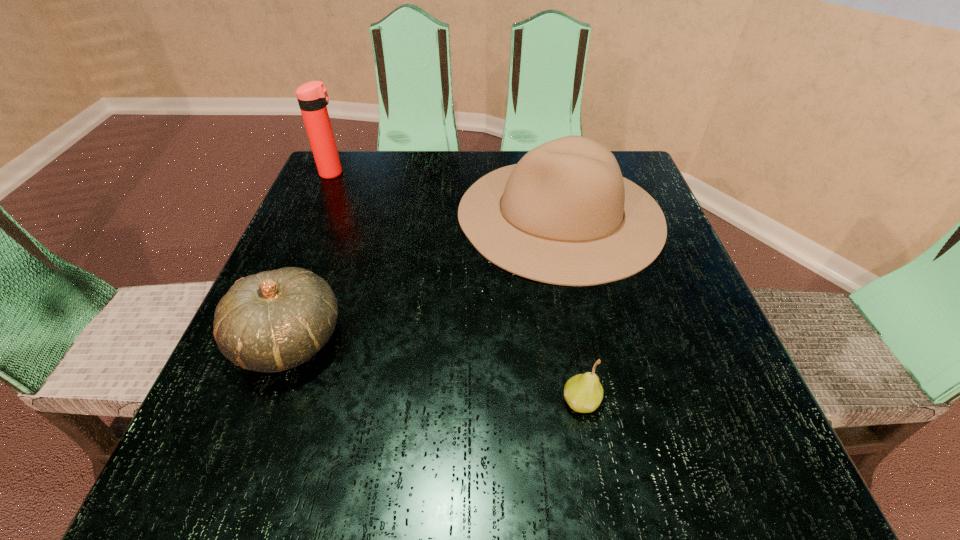
Identify the location of thermos bottle. The height and width of the screenshot is (540, 960). (312, 96).

Find the location of `sombrero`. sombrero is located at coordinates (569, 217).

Image resolution: width=960 pixels, height=540 pixels. What are the coordinates of `the second shortest object` in the screenshot? It's located at (272, 321).

Where is `the shortest object`? The height and width of the screenshot is (540, 960). the shortest object is located at coordinates (583, 392).

Locate an element on the screen. This screenshot has width=960, height=540. blank space located on the right of the tallest object is located at coordinates (476, 173).

In order to click on blank space located on the front of the sombrero in this screenshot , I will do `click(597, 391)`.

I want to click on vacant space located on the back of the third tallest object, so click(x=326, y=244).

What are the coordinates of `vacant region located on the left of the shortest object` in the screenshot? It's located at (499, 401).

Locate an element on the screen. thermos bottle that is at the far edge is located at coordinates (312, 96).

This screenshot has width=960, height=540. I want to click on sombrero that is positioned at the far edge, so click(x=569, y=217).